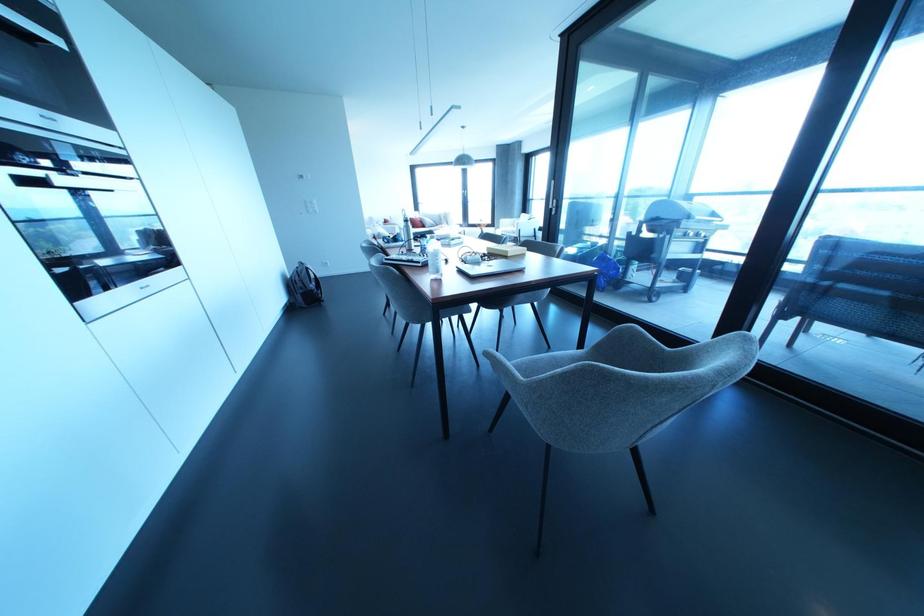
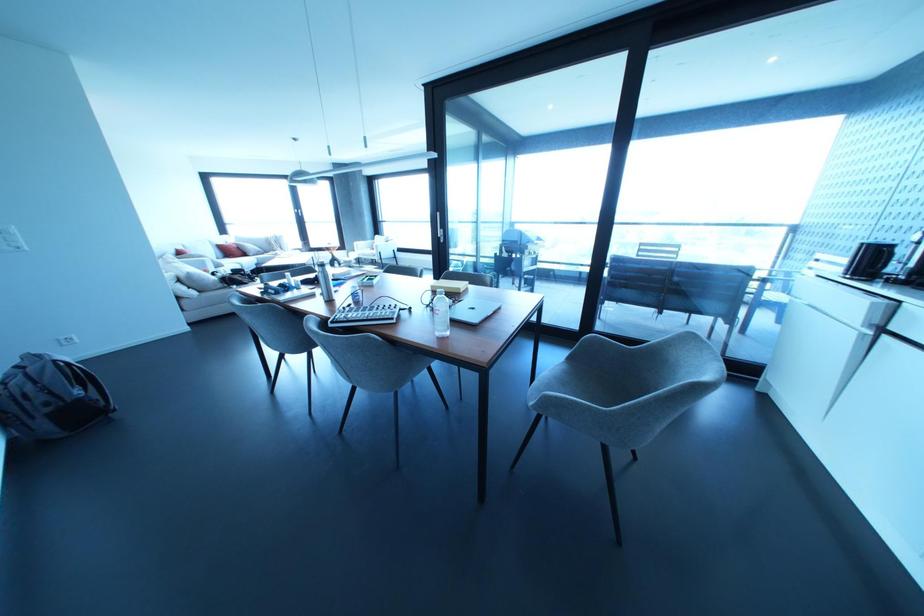
The point at (487, 248) is marked in the first image. Where is the corresponding point in the second image?

(431, 286)